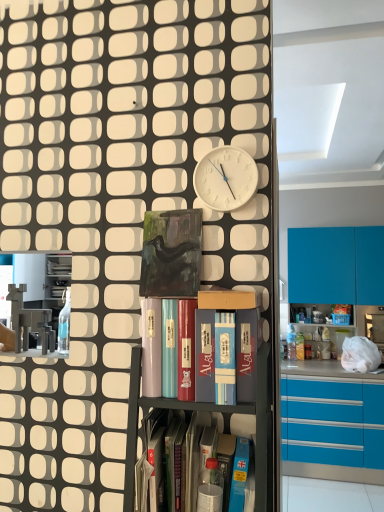
Question: Is there a large distance between white matte clock at upper center and blue glossy cupboard at center?

Choices:
 (A) no
 (B) yes

Answer: (A)

Question: From a real-world perspective, is white matte clock at upper center physically below blue glossy cupboard at center?

Choices:
 (A) no
 (B) yes

Answer: (A)

Question: Can blue glossy cupboard at center be found inside white matte clock at upper center?

Choices:
 (A) no
 (B) yes

Answer: (A)

Question: Can you confirm if white matte clock at upper center is smaller than blue glossy cupboard at center?

Choices:
 (A) no
 (B) yes

Answer: (B)

Question: Considering the relative positions of white matte clock at upper center and blue glossy cupboard at center in the image provided, is white matte clock at upper center to the left of blue glossy cupboard at center from the viewer's perspective?

Choices:
 (A) no
 (B) yes

Answer: (A)

Question: Is green glass book at center wider or thinner than metallic gray shelf at left, which is the 1th shelf in left-to-right order?

Choices:
 (A) wide
 (B) thin

Answer: (B)

Question: Looking at the image, does green glass book at center seem bigger or smaller compared to metallic gray shelf at left, placed as the fourth shelf when sorted from right to left?

Choices:
 (A) small
 (B) big

Answer: (A)

Question: From a real-world perspective, is green glass book at center physically located above or below metallic gray shelf at left, placed as the fourth shelf when sorted from right to left?

Choices:
 (A) above
 (B) below

Answer: (A)

Question: Visually, is green glass book at center positioned to the left or to the right of metallic gray shelf at left, placed as the fourth shelf when sorted from right to left?

Choices:
 (A) left
 (B) right

Answer: (B)

Question: In the image, is matte cardboard box at center, which is the third shelf in left-to-right order, on the left side or the right side of green glass book at center?

Choices:
 (A) right
 (B) left

Answer: (A)

Question: From the image's perspective, is matte cardboard box at center, which is the third shelf in left-to-right order, located above or below green glass book at center?

Choices:
 (A) above
 (B) below

Answer: (B)

Question: Relative to green glass book at center, is matte cardboard box at center, placed as the second shelf when sorted from right to left, in front or behind?

Choices:
 (A) behind
 (B) front

Answer: (B)

Question: Based on their sizes in the image, would you say matte cardboard box at center, which is the third shelf in left-to-right order, is bigger or smaller than green glass book at center?

Choices:
 (A) small
 (B) big

Answer: (B)

Question: Is metallic gray bookshelf at center, which is counted as the 3th shelf, starting from the right, taller or shorter than blue glossy cupboard at center?

Choices:
 (A) tall
 (B) short

Answer: (B)

Question: From the image's perspective, is metallic gray bookshelf at center, which is counted as the 3th shelf, starting from the right, above or below blue glossy cupboard at center?

Choices:
 (A) below
 (B) above

Answer: (A)